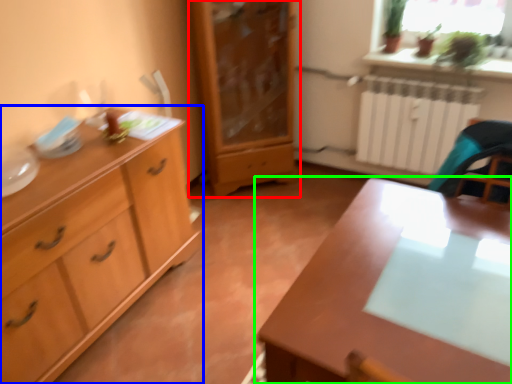
Question: Which object is positioned farthest from chest of drawers (highlighted by a red box)? Select from chest of drawers (highlighted by a blue box) and table (highlighted by a green box).

Choices:
 (A) chest of drawers
 (B) table

Answer: (B)